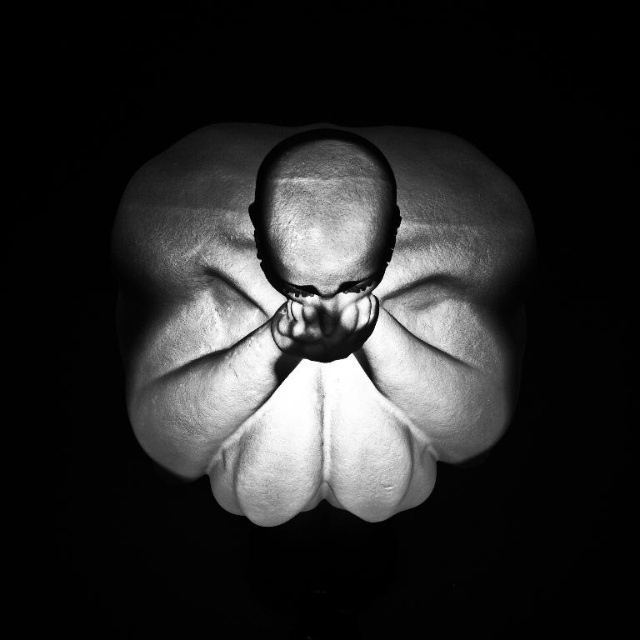
Question: Which point appears closest to the camera in this image?

Choices:
 (A) (364, 337)
 (B) (332, 438)

Answer: (A)

Question: Is smooth flesh flower at center above smooth skin hand at center?

Choices:
 (A) no
 (B) yes

Answer: (B)

Question: Does smooth flesh flower at center have a smaller size compared to smooth skin hand at center?

Choices:
 (A) yes
 (B) no

Answer: (B)

Question: Is smooth flesh flower at center positioned before smooth skin hand at center?

Choices:
 (A) no
 (B) yes

Answer: (B)